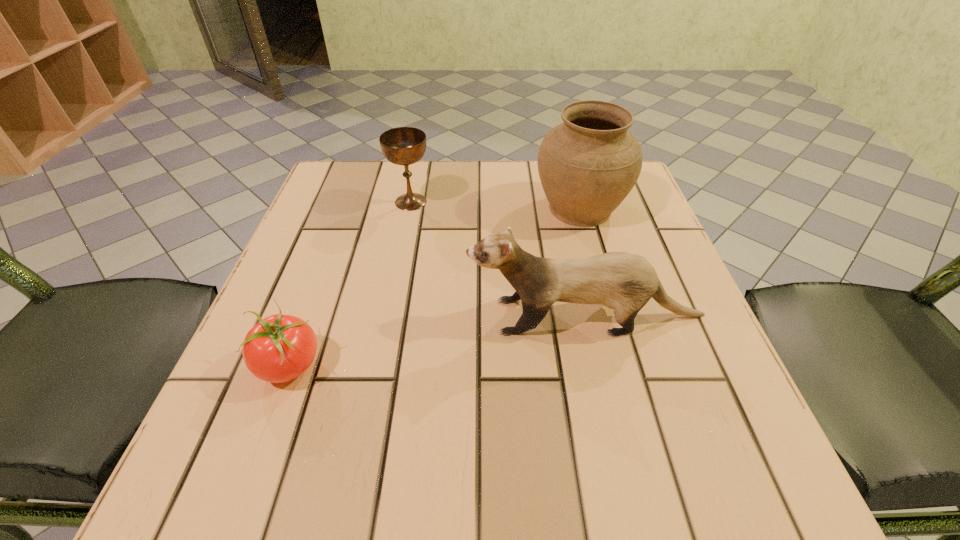
Image resolution: width=960 pixels, height=540 pixels. Identify the location of urn. (587, 165).

Identify the location of ferret. Image resolution: width=960 pixels, height=540 pixels. (625, 282).

Identify the location of the third object from right to left. Image resolution: width=960 pixels, height=540 pixels. (404, 146).

Image resolution: width=960 pixels, height=540 pixels. Identify the location of the leftmost object. (279, 348).

This screenshot has height=540, width=960. What are the coordinates of `the shortest object` in the screenshot? It's located at (279, 348).

You are a GUI agent. You are given a task and a screenshot of the screen. Output one action in this format:
    pyautogui.click(x=<x>, y=<y>)
    Task: Click on the vacant position located 0.210m on the left of the tallest object
    The image size is (960, 540).
    Given the screenshot: What is the action you would take?
    pyautogui.click(x=440, y=208)

I want to click on vacant space located on the face of the ferret, so click(369, 316).

Where is `vacant region located 0.220m on the face of the ferret`? vacant region located 0.220m on the face of the ferret is located at coordinates (340, 316).

Find the location of a particular element. This screenshot has width=960, height=540. free space located 0.200m on the face of the ferret is located at coordinates (351, 316).

The height and width of the screenshot is (540, 960). What are the coordinates of `free space located 0.170m on the front of the second object from left to right` in the screenshot? It's located at (398, 266).